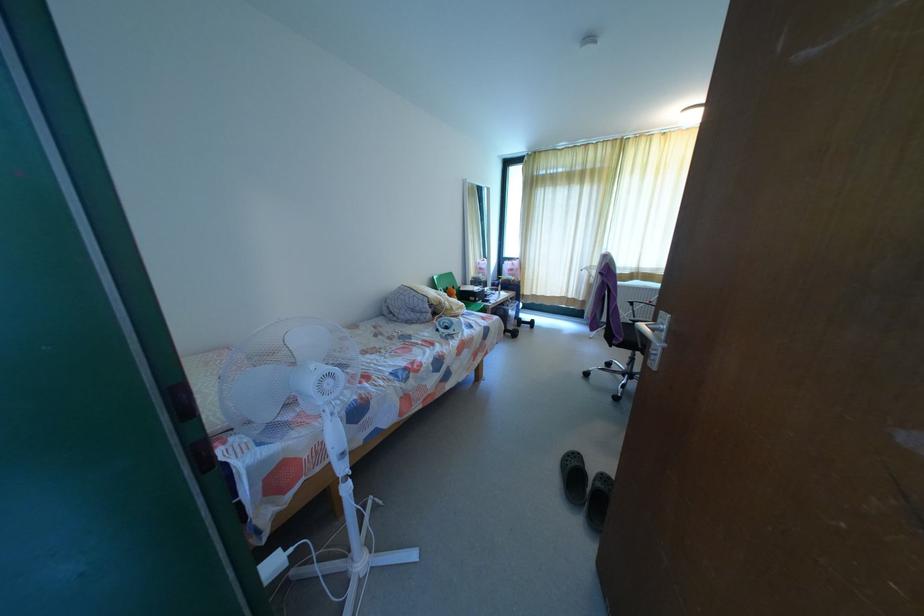
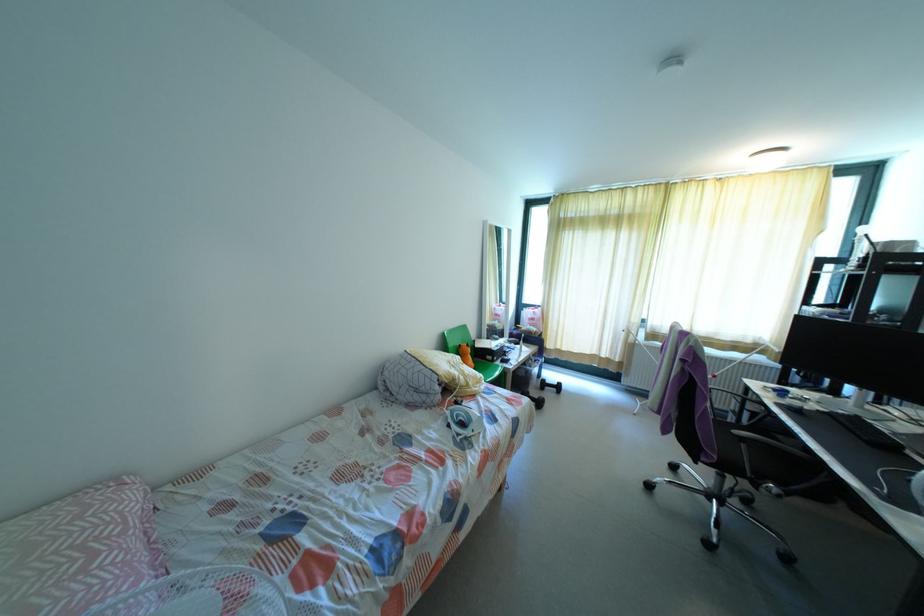
Find the pixel in the second image that matches point (507, 331) in the first image.

(531, 399)